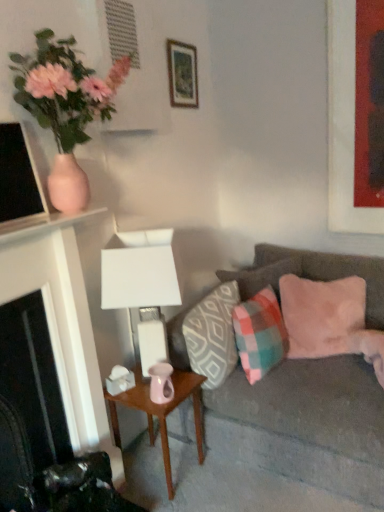
Question: Does pink matte vase at upper left appear on the right side of plaid fabric pillow at center, which is counted as the second pillow, starting from the right?

Choices:
 (A) yes
 (B) no

Answer: (B)

Question: Considering the relative sizes of pink matte vase at upper left and plaid fabric pillow at center, which is counted as the second pillow, starting from the right, in the image provided, is pink matte vase at upper left wider than plaid fabric pillow at center, which is counted as the second pillow, starting from the right,?

Choices:
 (A) yes
 (B) no

Answer: (A)

Question: Is plaid fabric pillow at center, which is counted as the second pillow, starting from the right, inside pink matte vase at upper left?

Choices:
 (A) no
 (B) yes

Answer: (A)

Question: Can you confirm if pink matte vase at upper left is smaller than plaid fabric pillow at center, which is counted as the second pillow, starting from the right?

Choices:
 (A) no
 (B) yes

Answer: (A)

Question: Can you confirm if pink matte vase at upper left is bigger than plaid fabric pillow at center, which is the 3th pillow in left-to-right order?

Choices:
 (A) yes
 (B) no

Answer: (A)

Question: Is pink matte vase at upper left aimed at plaid fabric pillow at center, which is counted as the second pillow, starting from the right?

Choices:
 (A) yes
 (B) no

Answer: (B)

Question: Considering the relative sizes of patterned fabric pillow at center, which appears as the first pillow when viewed from the left, and velvet gray couch at right in the image provided, is patterned fabric pillow at center, which appears as the first pillow when viewed from the left, thinner than velvet gray couch at right?

Choices:
 (A) no
 (B) yes

Answer: (B)

Question: Could you tell me if patterned fabric pillow at center, which appears as the first pillow when viewed from the left, is turned towards velvet gray couch at right?

Choices:
 (A) yes
 (B) no

Answer: (A)

Question: Does patterned fabric pillow at center, which appears as the first pillow when viewed from the left, come in front of velvet gray couch at right?

Choices:
 (A) no
 (B) yes

Answer: (A)

Question: Considering the relative sizes of patterned fabric pillow at center, which is the fourth pillow in right-to-left order, and velvet gray couch at right in the image provided, is patterned fabric pillow at center, which is the fourth pillow in right-to-left order, taller than velvet gray couch at right?

Choices:
 (A) yes
 (B) no

Answer: (B)

Question: Considering the relative sizes of patterned fabric pillow at center, which is the fourth pillow in right-to-left order, and velvet gray couch at right in the image provided, is patterned fabric pillow at center, which is the fourth pillow in right-to-left order, shorter than velvet gray couch at right?

Choices:
 (A) yes
 (B) no

Answer: (A)

Question: Is patterned fabric pillow at center, which is the fourth pillow in right-to-left order, looking in the opposite direction of velvet gray couch at right?

Choices:
 (A) no
 (B) yes

Answer: (B)

Question: Is pink glossy vase at center wider than matte red picture frame at upper right, the second picture frame positioned from the left?

Choices:
 (A) no
 (B) yes

Answer: (B)